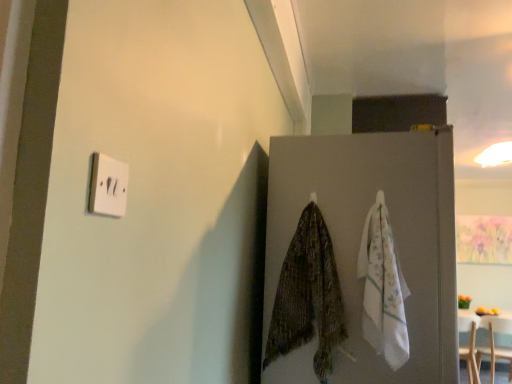
Image resolution: width=512 pixels, height=384 pixels. Describe the element at coordinates (496, 346) in the screenshot. I see `wooden table at lower right` at that location.

Image resolution: width=512 pixels, height=384 pixels. In order to click on white cotton towel at right in this screenshot , I will do `click(383, 288)`.

At what (x,y) coordinates should I click in order to perform the action: click on wooden table at lower right. Please return your answer as a coordinate pair (x, y). Looking at the image, I should click on (496, 346).

Is white cotton towel at right turned away from wooden table at lower right?

No, wooden table at lower right is not at the back of white cotton towel at right.

Where is `furniture behind the white cotton towel at right`? furniture behind the white cotton towel at right is located at coordinates (496, 346).

From the image's perspective, who appears lower, white cotton towel at right or wooden table at lower right?

wooden table at lower right, from the image's perspective.

Can you see white cotton towel at right touching wooden table at lower right?

No, white cotton towel at right is not with wooden table at lower right.

Measure the distance between white cotton towel at right and gray matte refrigerator at center.

The distance of white cotton towel at right from gray matte refrigerator at center is 5.26 inches.

Who is taller, white cotton towel at right or gray matte refrigerator at center?

With more height is gray matte refrigerator at center.

Is white cotton towel at right positioned in front of gray matte refrigerator at center?

Yes, white cotton towel at right is in front of gray matte refrigerator at center.

Which point is more forward, (386, 249) or (330, 151)?

Positioned in front is point (386, 249).

Does point (321, 226) come behind point (377, 312)?

Yes, point (321, 226) is behind point (377, 312).

Could you tell me if textured green scarf at center is facing white cotton towel at right?

No, textured green scarf at center is not turned towards white cotton towel at right.

Is white cotton towel at right surrounded by textured green scarf at center?

No, white cotton towel at right is not a part of textured green scarf at center.

Does textured green scarf at center have a greater width compared to white cotton towel at right?

Yes.

From a real-world perspective, is textured green scarf at center on top of gray matte refrigerator at center?

Correct, in the physical world, textured green scarf at center is higher than gray matte refrigerator at center.

Considering the sizes of textured green scarf at center and gray matte refrigerator at center in the image, is textured green scarf at center taller or shorter than gray matte refrigerator at center?

In the image, textured green scarf at center appears to be shorter than gray matte refrigerator at center.

Which of these two, textured green scarf at center or gray matte refrigerator at center, is bigger?

With larger size is gray matte refrigerator at center.

What's the angular difference between textured green scarf at center and gray matte refrigerator at center's facing directions?

90 degrees separate the facing orientations of textured green scarf at center and gray matte refrigerator at center.

Are white cotton towel at right and white plastic light switch at upper left far apart?

Yes, white cotton towel at right and white plastic light switch at upper left are located far from each other.

Which object is wider, white cotton towel at right or white plastic light switch at upper left?

With larger width is white cotton towel at right.

Could you tell me if white cotton towel at right is facing white plastic light switch at upper left?

No, white cotton towel at right is not oriented towards white plastic light switch at upper left.

From the picture: From the image's perspective, does white cotton towel at right appear higher than white plastic light switch at upper left?

No.

Considering the relative positions of wooden table at lower right and white cotton towel at right in the image provided, is wooden table at lower right to the left or to the right of white cotton towel at right?

wooden table at lower right is positioned on white cotton towel at right's right side.

Is wooden table at lower right in front of or behind white cotton towel at right in the image?

wooden table at lower right is positioned farther from the viewer than white cotton towel at right.

Is wooden table at lower right looking in the opposite direction of white cotton towel at right?

No, wooden table at lower right is not facing away from white cotton towel at right.

How different are the orientations of wooden table at lower right and white cotton towel at right in degrees?

There is a 178-degree angle between the facing directions of wooden table at lower right and white cotton towel at right.

How far apart are textured green scarf at center and white plastic light switch at upper left?

textured green scarf at center and white plastic light switch at upper left are 97.29 centimeters apart.

Locate an element on the screen. This screenshot has width=512, height=384. light switch above the textured green scarf at center (from the image's perspective) is located at coordinates (108, 186).

From the picture: Are textured green scarf at center and white plastic light switch at upper left making contact?

They are not placed beside each other.

Locate an element on the screen. Image resolution: width=512 pixels, height=384 pixels. blanket above the wooden table at lower right (from the image's perspective) is located at coordinates (383, 288).

There is a gray matte refrigerator at center. At what (x,y) coordinates should I click in order to perform the action: click on blanket above it (from a real-world perspective). Please return your answer as a coordinate pair (x, y). The image size is (512, 384). Looking at the image, I should click on (383, 288).

Which object lies nearer to the anchor point white plastic light switch at upper left, gray matte refrigerator at center or wooden table at lower right?

The object closer to white plastic light switch at upper left is gray matte refrigerator at center.

Based on their spatial positions, is white plastic light switch at upper left or gray matte refrigerator at center closer to textured green scarf at center?

Based on the image, gray matte refrigerator at center appears to be nearer to textured green scarf at center.

Estimate the real-world distances between objects in this image. Which object is further from gray matte refrigerator at center, wooden table at lower right or white cotton towel at right?

wooden table at lower right is further to gray matte refrigerator at center.

Which object lies further to the anchor point wooden table at lower right, textured green scarf at center or gray matte refrigerator at center?

textured green scarf at center is further to wooden table at lower right.

When comparing their distances from wooden table at lower right, does white cotton towel at right or gray matte refrigerator at center seem closer?

gray matte refrigerator at center lies closer to wooden table at lower right than the other object.

From the image, which object appears to be nearer to white plastic light switch at upper left, textured green scarf at center or wooden table at lower right?

textured green scarf at center is positioned closer to the anchor white plastic light switch at upper left.

Looking at the image, which one is located closer to white plastic light switch at upper left, textured green scarf at center or gray matte refrigerator at center?

textured green scarf at center.

Based on their spatial positions, is white cotton towel at right or textured green scarf at center closer to gray matte refrigerator at center?

white cotton towel at right.

Image resolution: width=512 pixels, height=384 pixels. I want to click on blanket between textured green scarf at center and gray matte refrigerator at center, so click(383, 288).

The width and height of the screenshot is (512, 384). What are the coordinates of `blanket between white plastic light switch at upper left and wooden table at lower right in the front-back direction` in the screenshot? It's located at (383, 288).

Find the location of a particular element. door between textured green scarf at center and wooden table at lower right along the z-axis is located at coordinates (362, 232).

Locate an element on the screen. The height and width of the screenshot is (384, 512). clothe located between white cotton towel at right and wooden table at lower right in the depth direction is located at coordinates (308, 297).